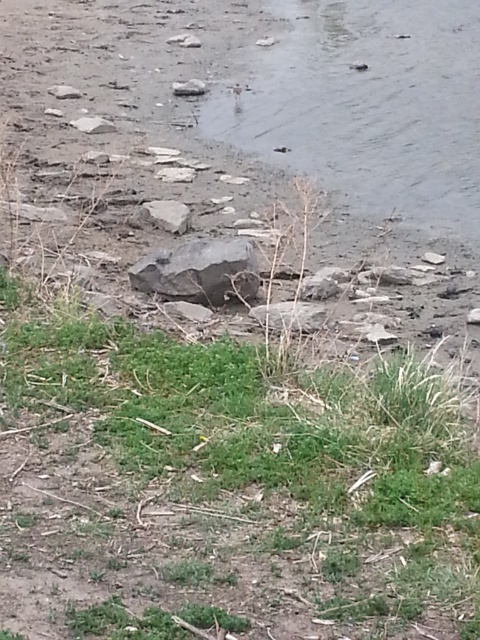
Question: Does green grass at lower center appear over gray rough stone at center?

Choices:
 (A) yes
 (B) no

Answer: (B)

Question: Estimate the real-world distances between objects in this image. Which object is closer to the white smooth rock at upper left?

Choices:
 (A) green grass at lower center
 (B) gray rough stone at center

Answer: (B)

Question: Observing the image, what is the correct spatial positioning of green grass at lower center in reference to gray rough stone at center?

Choices:
 (A) above
 (B) below

Answer: (B)

Question: Is gray rough stone at center behind white smooth rock at upper left?

Choices:
 (A) yes
 (B) no

Answer: (B)

Question: Which point is farther to the camera?

Choices:
 (A) gray rough stone at center
 (B) white smooth rock at upper left
 (C) gray rough rock at center
 (D) green grass at lower center

Answer: (B)

Question: Which of the following is the closest to the observer?

Choices:
 (A) (211, 260)
 (B) (180, 225)
 (C) (94, 116)
 (D) (98, 460)

Answer: (D)